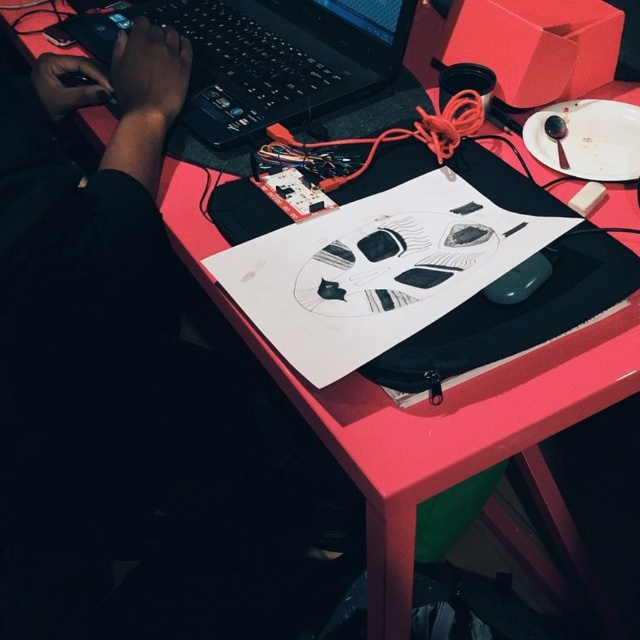
Question: Which of the following is the farthest from the observer?

Choices:
 (A) black plastic laptop at upper left
 (B) black matte mouse at center

Answer: (A)

Question: Does black plastic laptop at upper left appear under black matte mouse at center?

Choices:
 (A) yes
 (B) no

Answer: (B)

Question: Which of the following is the closest to the observer?

Choices:
 (A) (492, 289)
 (B) (196, 52)

Answer: (A)

Question: Can you confirm if black plastic laptop at upper left is positioned to the right of black matte mouse at center?

Choices:
 (A) no
 (B) yes

Answer: (A)

Question: Does black plastic laptop at upper left appear under black matte mouse at center?

Choices:
 (A) yes
 (B) no

Answer: (B)